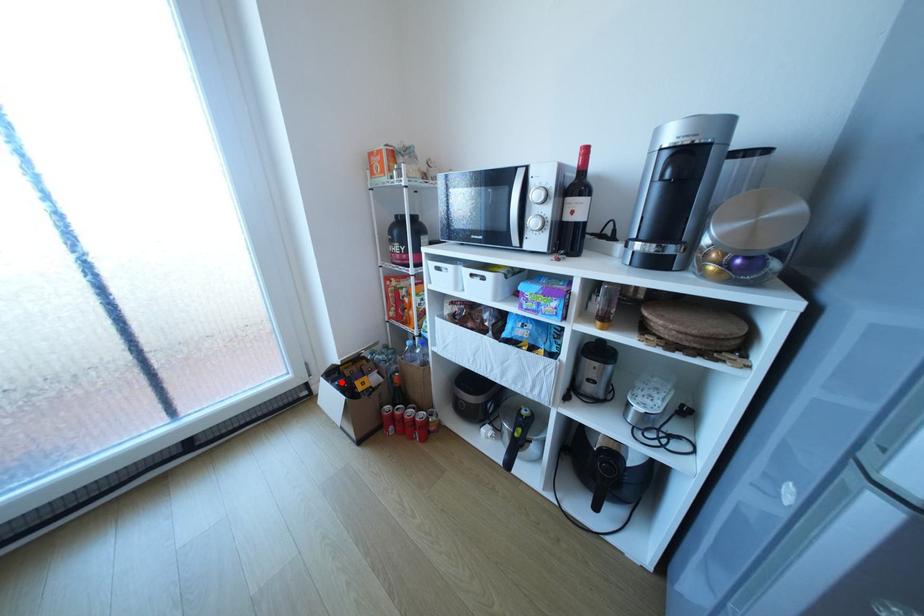
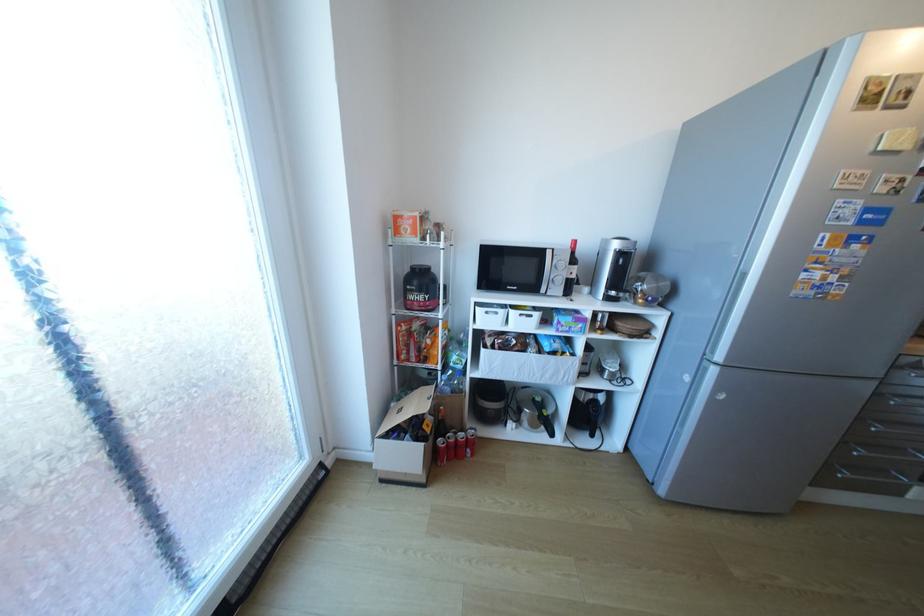
The point at the highlighted location is marked in the first image. Where is the corresponding point in the second image?

(407, 437)